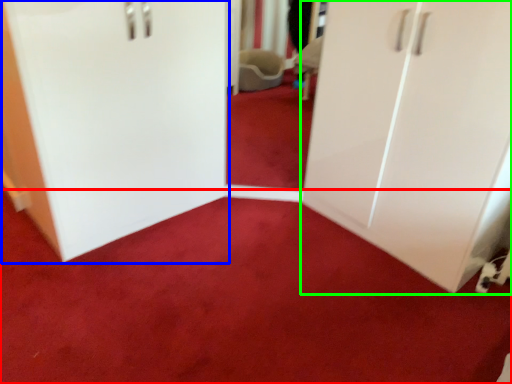
Question: Which is farther away from plain (highlighted by a red box)? door (highlighted by a blue box) or cupboard (highlighted by a green box)?

Choices:
 (A) door
 (B) cupboard

Answer: (A)